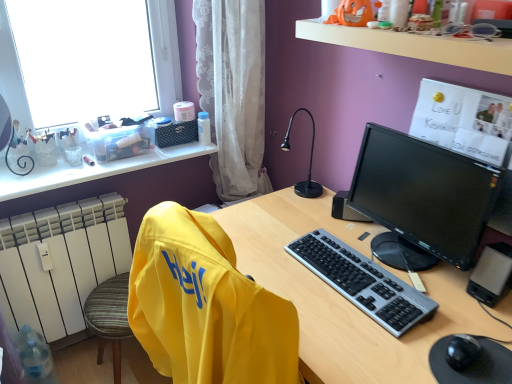
Question: From a real-world perspective, is white plastic window sill at upper center physically located above or below white lace curtain at center?

Choices:
 (A) above
 (B) below

Answer: (A)

Question: Considering the positions of point (312, 26) and point (257, 129), is point (312, 26) closer or farther from the camera than point (257, 129)?

Choices:
 (A) closer
 (B) farther

Answer: (A)

Question: Based on their relative distances, which object is farther from the black plastic computer tower at lower right?

Choices:
 (A) white plastic radiator at left
 (B) matte plastic desk at center
 (C) black glossy monitor at center right
 (D) black plastic speaker at right
 (E) white plastic window sill at upper center

Answer: (A)

Question: Which is nearer to the black plastic speaker at right?

Choices:
 (A) black plastic computer tower at lower right
 (B) matte plastic desk at center
 (C) black glossy monitor at center right
 (D) yellow fabric swivel chair at left
 (E) white plastic radiator at left

Answer: (C)